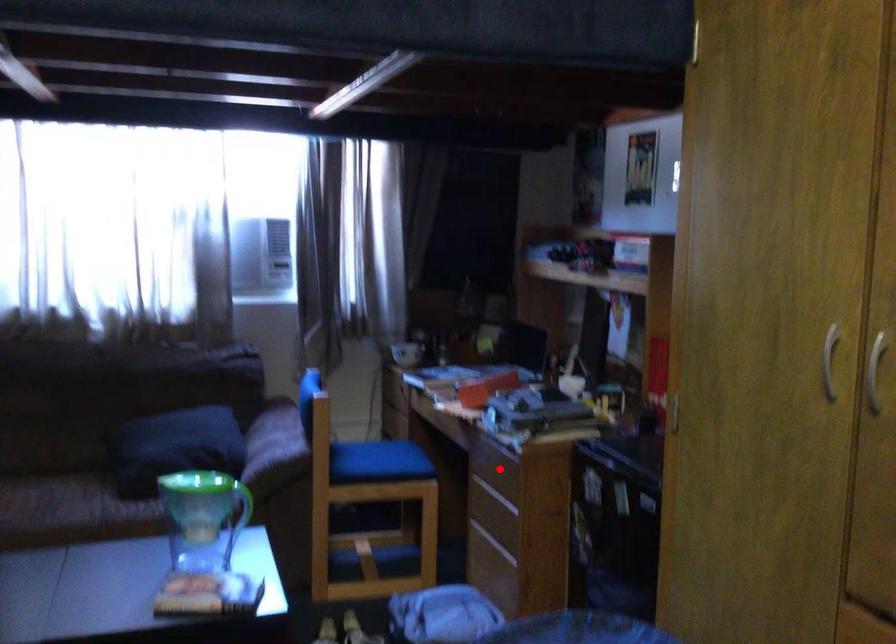
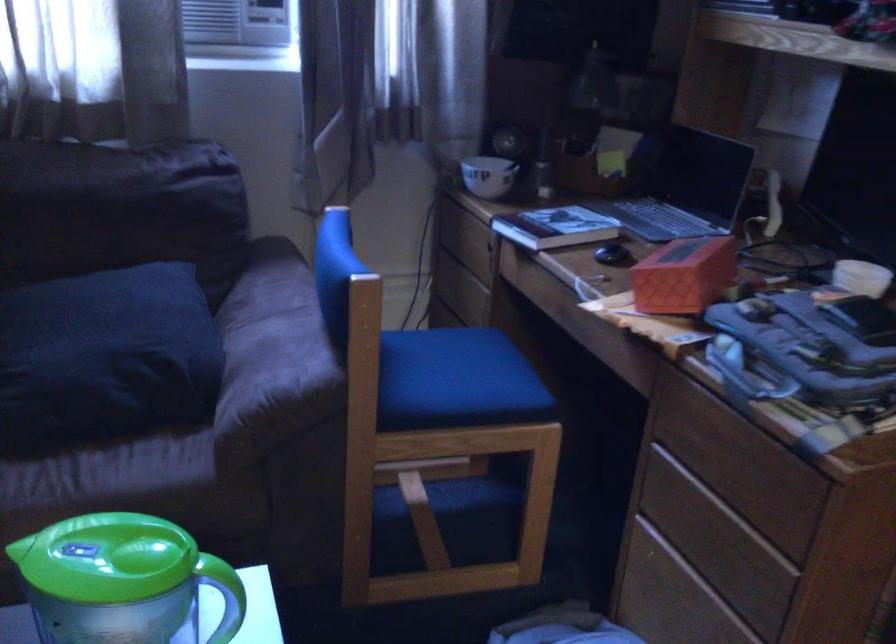
Question: I am providing you with two images of the same scene from different viewpoints. A red point is shown in image1. For the corresponding object point in image2, is it positioned nearer or farther from the camera?

Choices:
 (A) Nearer
 (B) Farther

Answer: (A)